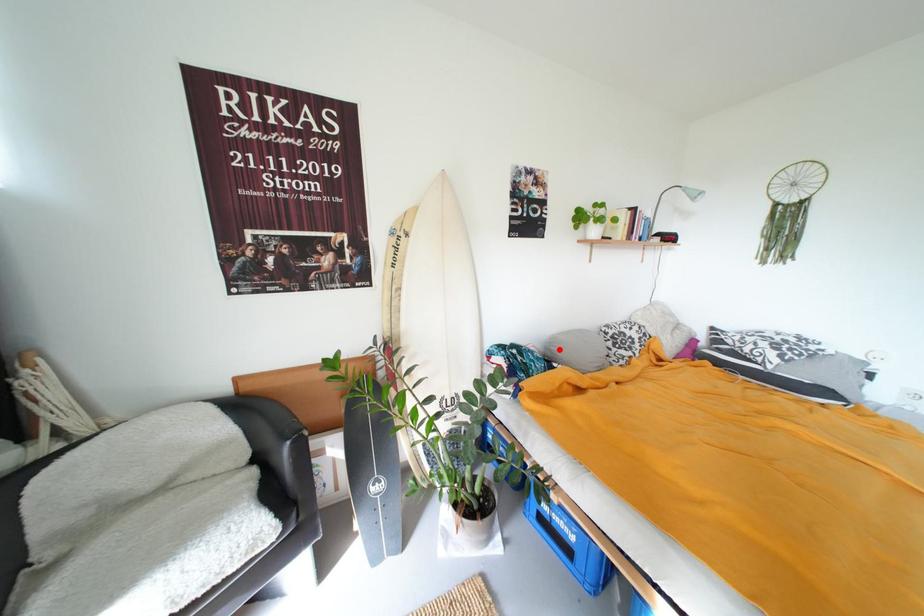
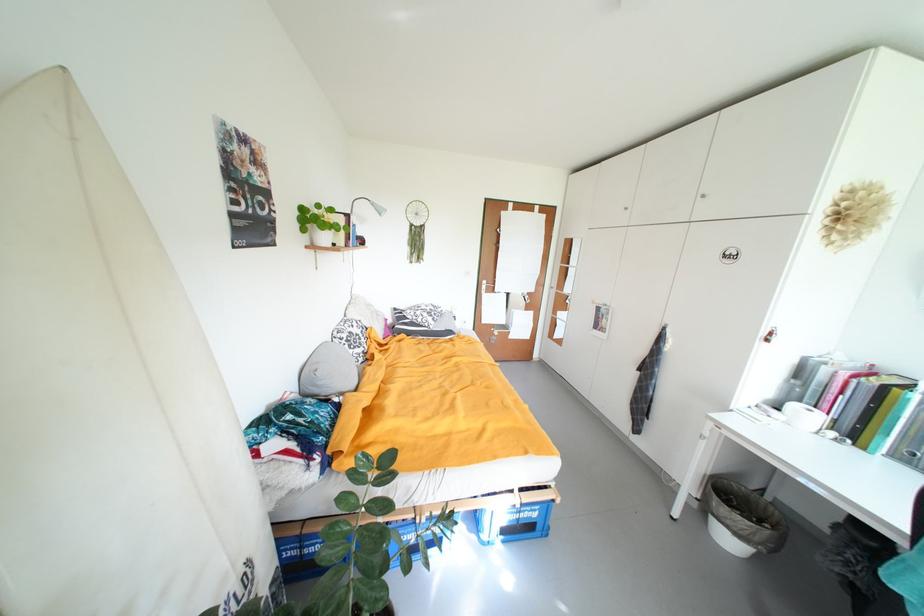
Find the pixel in the second image that matches the highlighted location in the first image.

(326, 385)